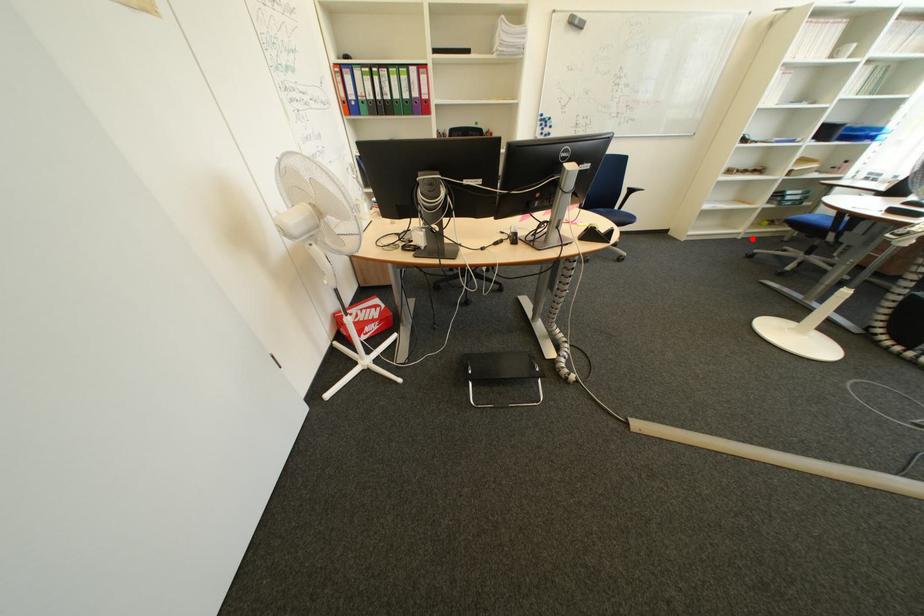
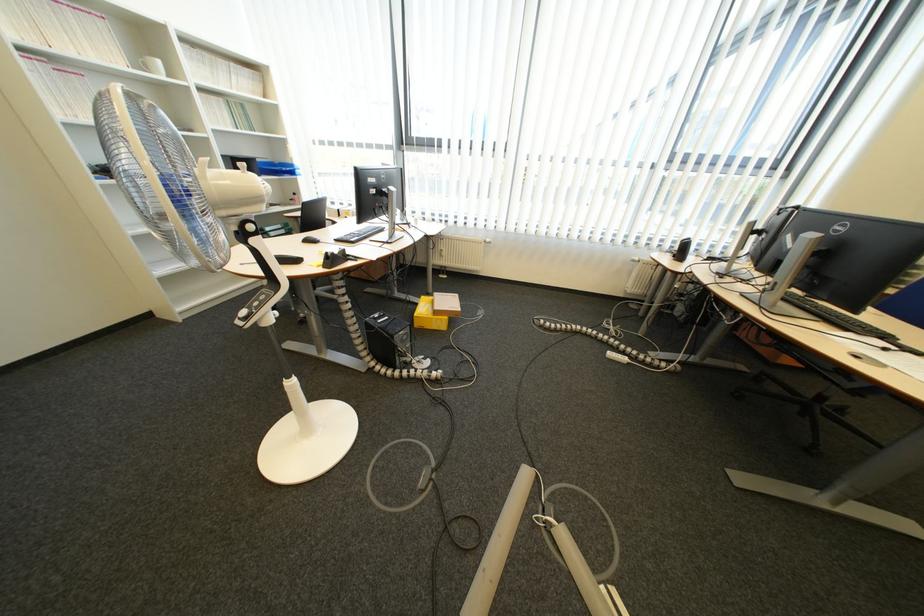
Find the pixel in the second image that matches the highlighted location in the first image.

(277, 285)